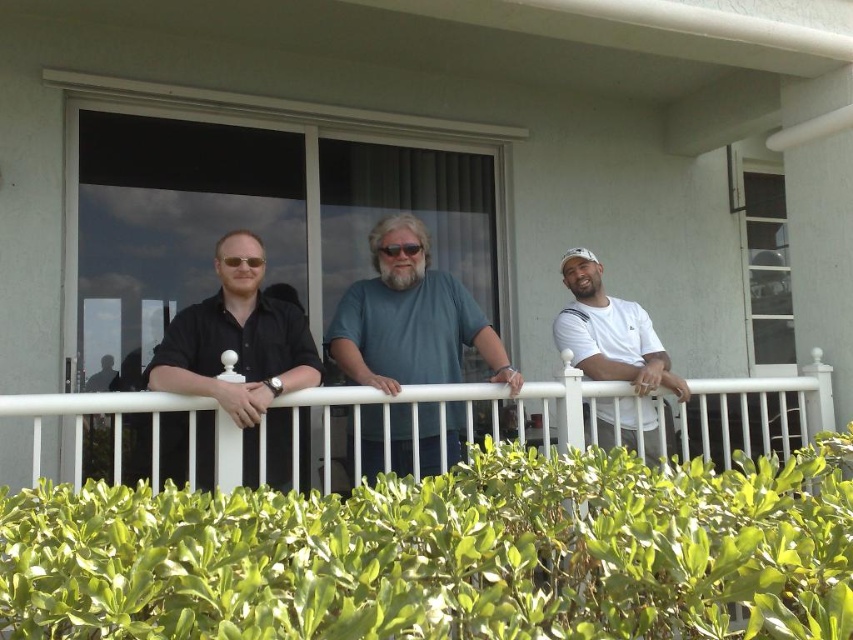
You are a photographer trying to capture a group photo of the black matte shirt at center and the teal matte shirt at center. Since you want to ensure both shirts are clearly visible, which shirt should you focus on first to account for their sizes?

The black matte shirt at center has a larger width than the teal matte shirt at center, so you should focus on the black matte shirt at center first to ensure its details are captured clearly before adjusting for the smaller teal matte shirt at center.

You are a safety inspector evaluating the balcony setup. The white metal railing at center and the teal matte shirt at center are both visible in the scene. Based on their positions, which object is closer to the edge of the balcony?

The white metal railing at center is closer to the edge of the balcony because it is positioned in front of the teal matte shirt at center.